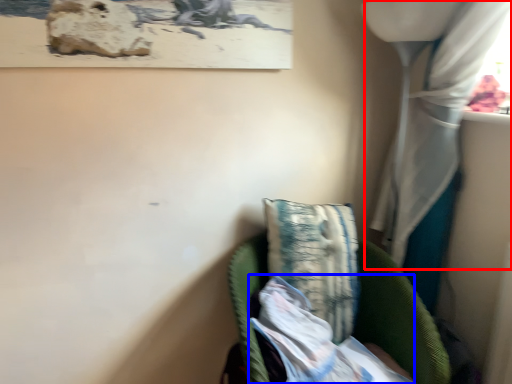
Question: Which object appears farthest to the camera in this image, curtain (highlighted by a red box) or wrapping paper (highlighted by a blue box)?

Choices:
 (A) curtain
 (B) wrapping paper

Answer: (B)